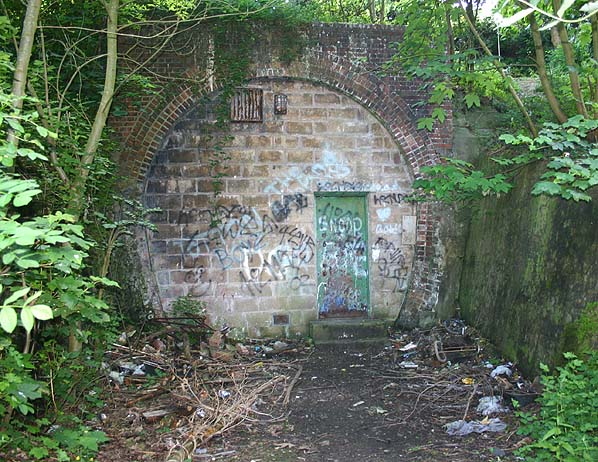
Locate an element on the screen. hanging vine on left is located at coordinates (216, 170).